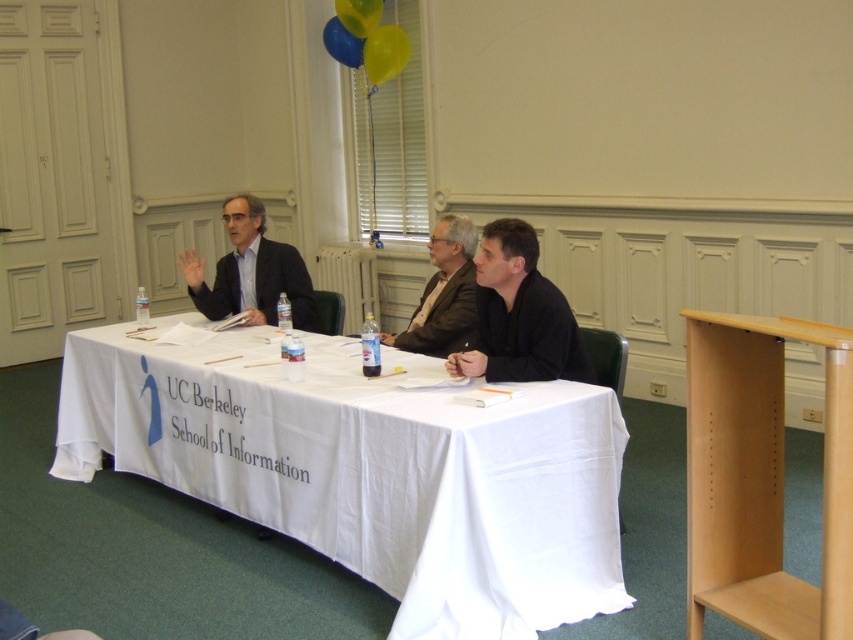
You are attending a UC Berkeley School of Information event and notice a matte black shirt at center and a rubberized blue balloon at upper center. Which object is positioned higher in the image?

The rubberized blue balloon at upper center is positioned higher than the matte black shirt at center.